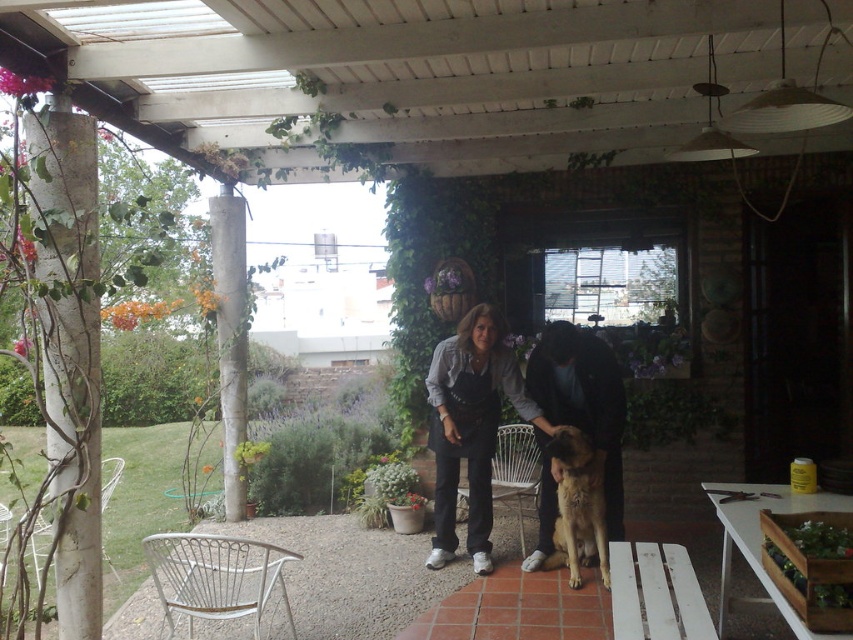
From the picture: You are a guest at this patio and want to place a small potted plant between the dark gray denim jacket at center and the dark brown fur at center. Which object should you place the plant closer to based on their heights?

The dark gray denim jacket at center is taller than the dark brown fur at center, so the plant should be placed closer to the dark gray denim jacket at center to maintain visual balance.